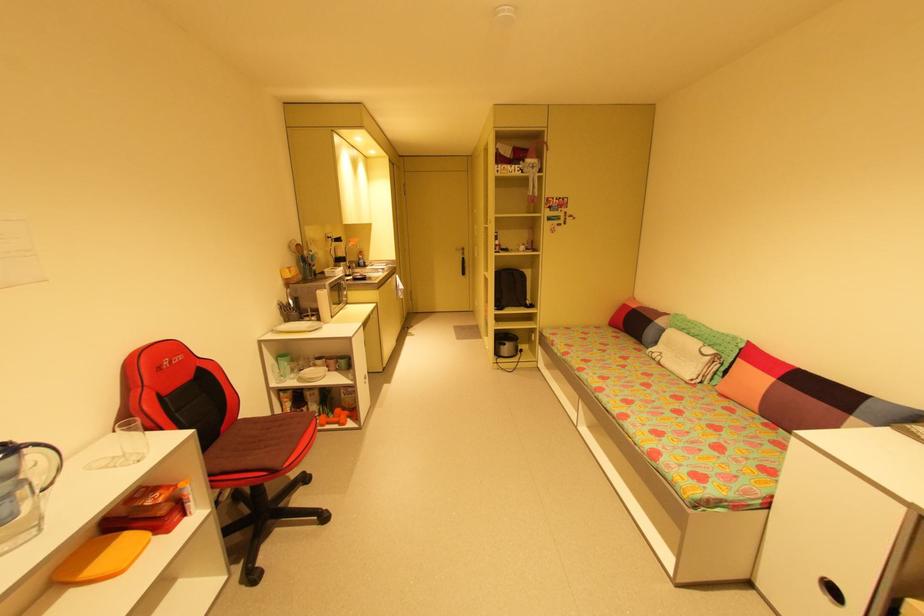
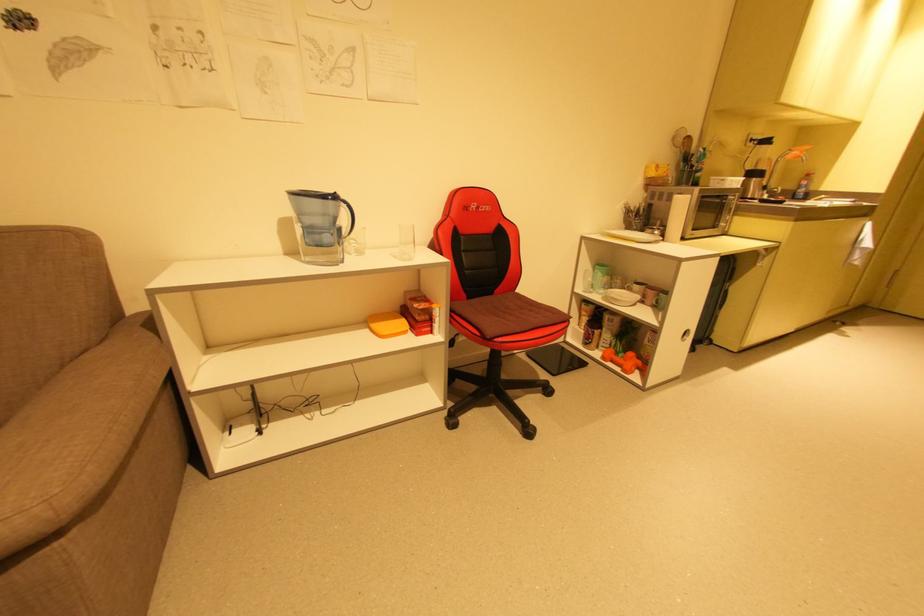
Where in the second image is the point corresponding to the point at 307,371 from the first image?

(616, 290)